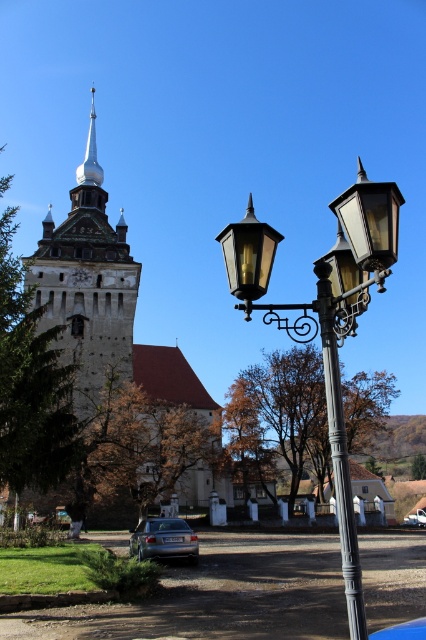
Does dark brown stone church at upper left appear on the right side of silver metallic car at center?

No, dark brown stone church at upper left is not to the right of silver metallic car at center.

Is point (131, 310) behind point (409, 522)?

No, it is in front of (409, 522).

Locate an element on the screen. The height and width of the screenshot is (640, 426). dark brown stone church at upper left is located at coordinates (103, 307).

Does matte black street light at center have a lesser width compared to satin silver sedan at lower left?

In fact, matte black street light at center might be wider than satin silver sedan at lower left.

Is matte black street light at center behind satin silver sedan at lower left?

No, it is in front of satin silver sedan at lower left.

This screenshot has height=640, width=426. What do you see at coordinates (327, 320) in the screenshot?
I see `matte black street light at center` at bounding box center [327, 320].

Locate an element on the screen. The width and height of the screenshot is (426, 640). matte black street light at center is located at coordinates (327, 320).

Who is taller, dark brown stone church at upper left or matte black street light at center?

Standing taller between the two is matte black street light at center.

Between dark brown stone church at upper left and matte black street light at center, which one is positioned lower?

dark brown stone church at upper left

Is point (101, 256) more distant than point (344, 228)?

Yes, point (101, 256) is farther from viewer.

Find the location of a particular element. The image size is (426, 640). dark brown stone church at upper left is located at coordinates (103, 307).